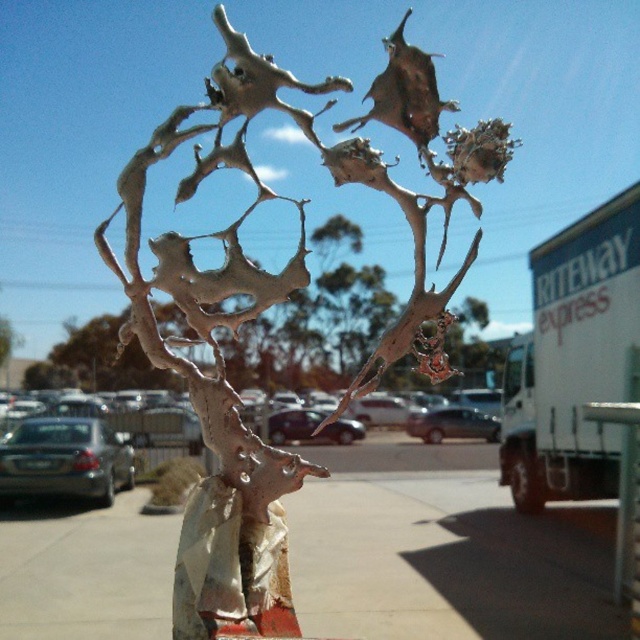
Is matte silver sculpture at center thinner than smooth concrete sidewalk at center?

Yes.

How much distance is there between matte silver sculpture at center and smooth concrete sidewalk at center?

The distance of matte silver sculpture at center from smooth concrete sidewalk at center is 81.58 centimeters.

Is point (269, 80) closer to camera compared to point (384, 580)?

That is True.

Locate an element on the screen. This screenshot has height=640, width=640. matte silver sculpture at center is located at coordinates (276, 304).